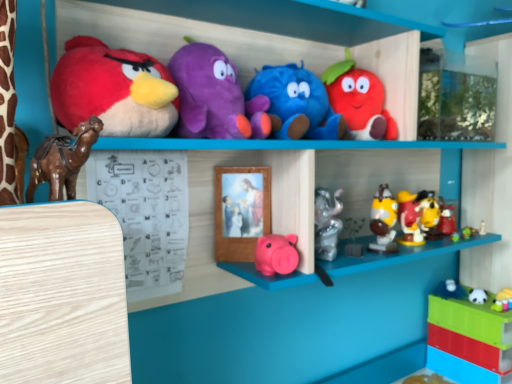
Question: Is wooden picture frame at center situated inside white plush panda at lower right, which ranks as the 3th toy in right-to-left order, or outside?

Choices:
 (A) inside
 (B) outside

Answer: (B)

Question: Looking at their shapes, would you say wooden picture frame at center is wider or thinner than white plush panda at lower right, which ranks as the 3th toy in right-to-left order?

Choices:
 (A) thin
 (B) wide

Answer: (A)

Question: Which of these objects is positioned closest to the matte plush strawberry at upper center, which appears as the 5th toy when viewed from the left?

Choices:
 (A) white glossy toy at lower right, arranged as the 11th toy when viewed from the left
 (B) matte plastic piggy bank at center, placed as the ninth toy when sorted from right to left
 (C) yellow matte figurine at right, the 8th toy positioned from the left
 (D) white plush panda at lower right, positioned as the 9th toy in left-to-right order
 (E) wooden picture frame at center

Answer: (E)

Question: Estimate the real-world distances between objects in this image. Which object is closer to the matte plastic piggy bank at center, positioned as the 3th toy in left-to-right order?

Choices:
 (A) shiny plastic toys at center right, which ranks as the 5th toy in right-to-left order
 (B) matte plush bird at upper left, the 11th toy viewed from the right
 (C) white glossy toy at lower right, arranged as the 11th toy when viewed from the left
 (D) yellow matte figurine at right, which is the 4th toy in right-to-left order
 (E) wooden picture frame at center

Answer: (E)